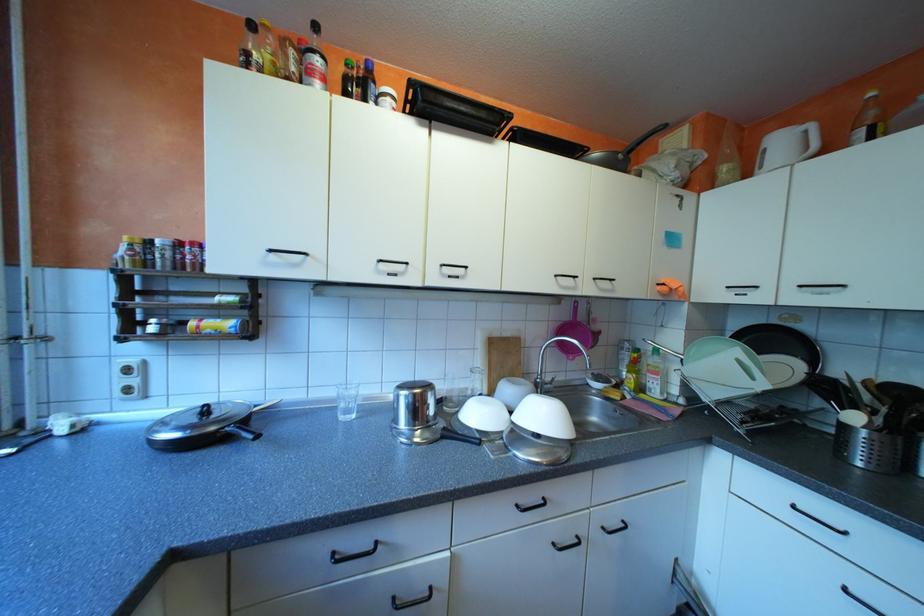
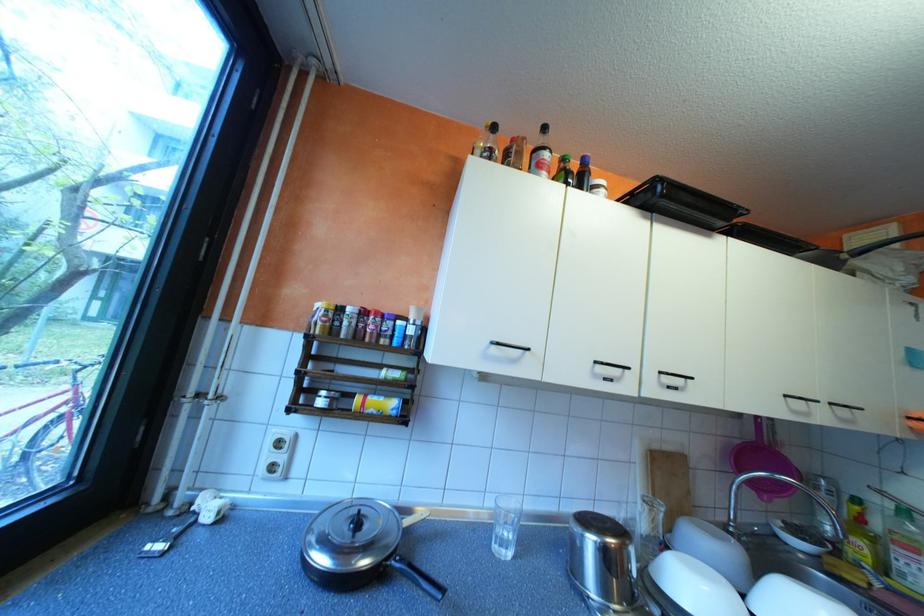
Find the pixel in the second image that matches (x=489, y=413) in the first image.

(709, 592)